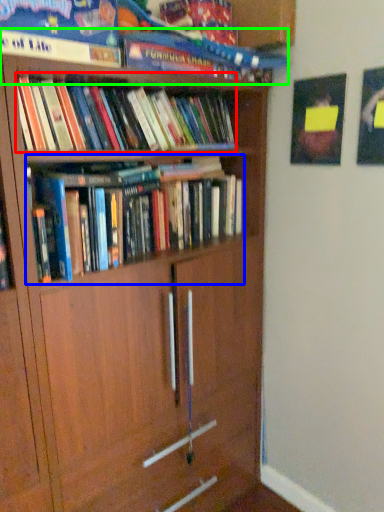
Question: Which is farther away from book (highlighted by a red box)? book (highlighted by a blue box) or book (highlighted by a green box)?

Choices:
 (A) book
 (B) book

Answer: (A)